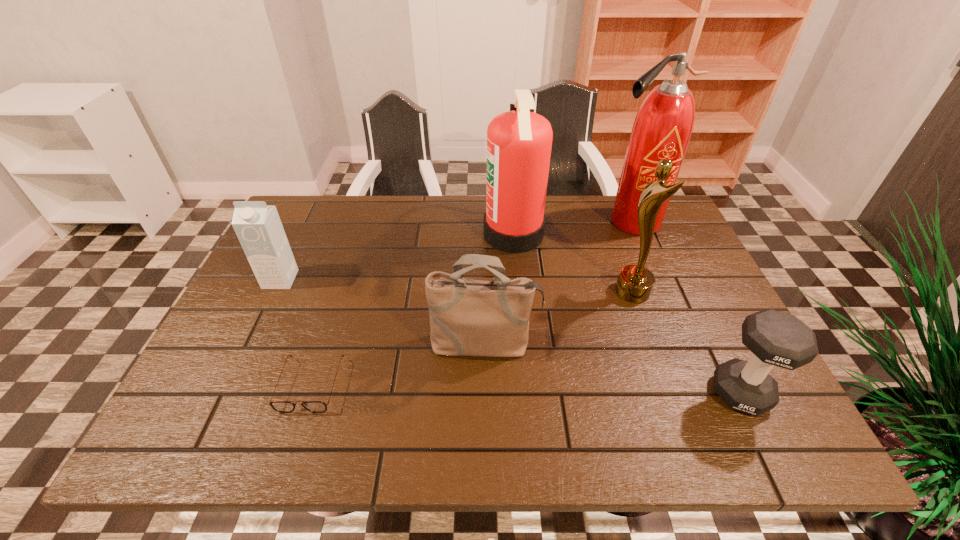
Locate an element on the screen. The width and height of the screenshot is (960, 540). object that is the third nearest to the shortest object is located at coordinates (519, 142).

The image size is (960, 540). I want to click on free spot that satisfies the following two spatial constraints: 1. at the nozzle of the left fire extinguisher; 2. on the front-facing side of the shoulder bag, so click(523, 345).

You are a GUI agent. You are given a task and a screenshot of the screen. Output one action in this format:
    pyautogui.click(x=<x>, y=<y>)
    Task: Click on the free space in the image that satisfies the following two spatial constraints: 1. on the front-facing side of the fifth shortest object; 2. on the front-facing side of the shoulder bag
    
    Given the screenshot: What is the action you would take?
    pyautogui.click(x=652, y=345)

Where is `vacant region that satisfies the following two spatial constraints: 1. at the nozzle of the left fire extinguisher; 2. on the back side of the second shortest object`? vacant region that satisfies the following two spatial constraints: 1. at the nozzle of the left fire extinguisher; 2. on the back side of the second shortest object is located at coordinates (528, 393).